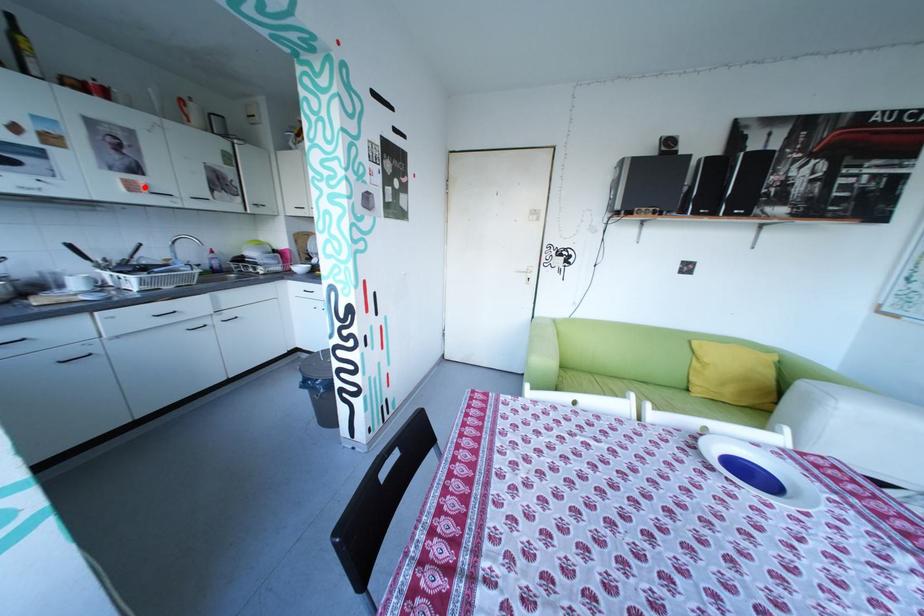
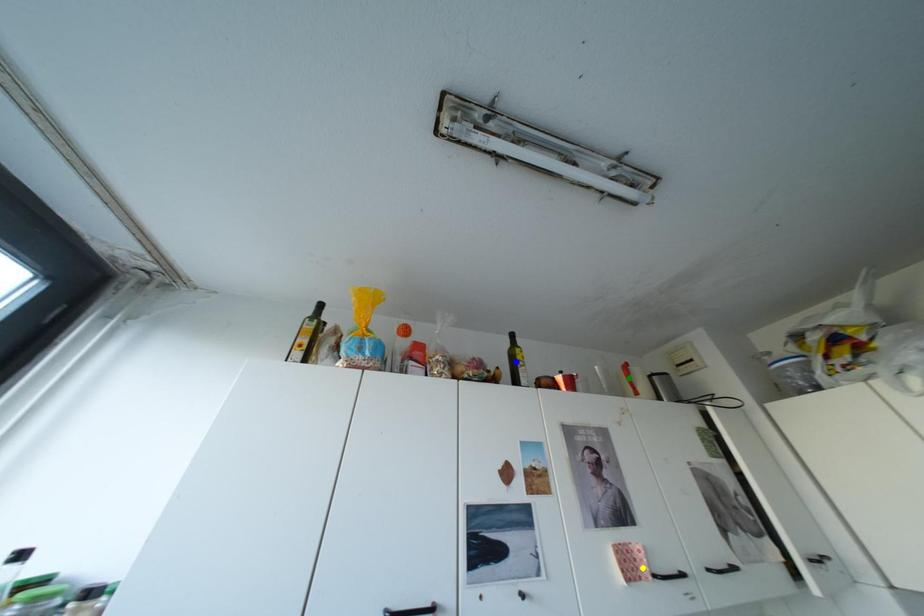
Question: I am providing you with two images of the same scene from different viewpoints. A red point is marked on the first image. You are given multiple points on the second image. In image 2, which mark is for the same physical point as the one in image 1?

Choices:
 (A) green point
 (B) blue point
 (C) yellow point

Answer: (C)